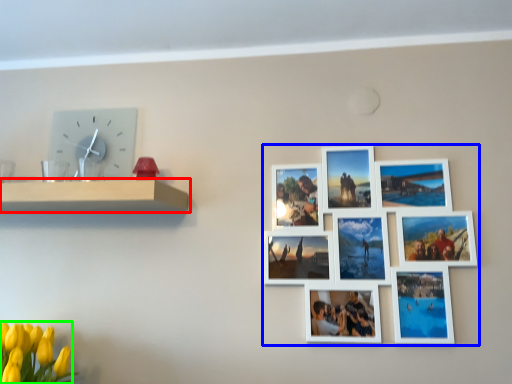
Question: Which object is positioned closest to shelf (highlighted by a red box)? Select from picture frame (highlighted by a blue box) and flower (highlighted by a green box).

Choices:
 (A) picture frame
 (B) flower

Answer: (B)